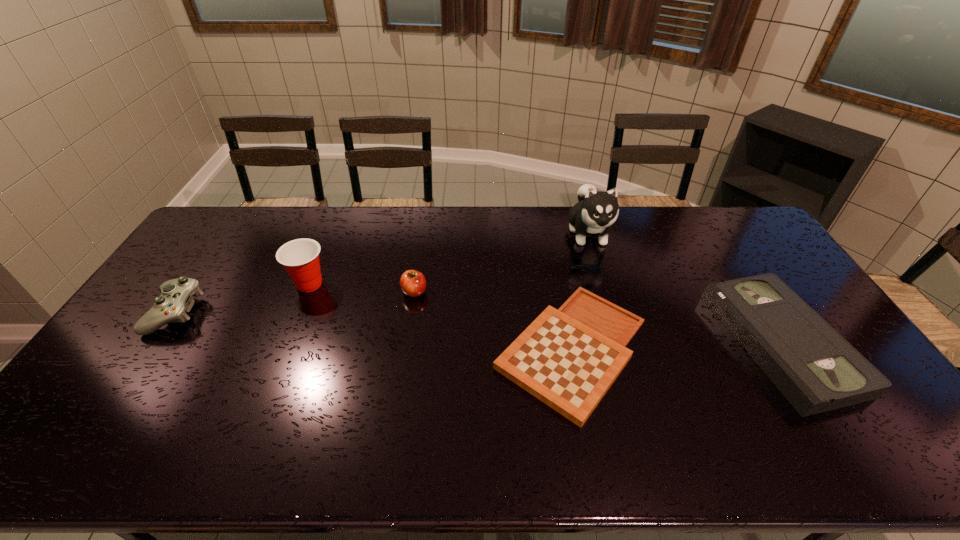
Identify the location of free region located 0.240m on the right of the cup. The height and width of the screenshot is (540, 960). (404, 284).

Identify the location of vacant space located on the back of the leftmost object. [x=228, y=235].

Identify the location of vacant space situated 0.100m on the back of the fourth object from right to left. [419, 263].

The height and width of the screenshot is (540, 960). In order to click on vacant position located on the back of the rightmost object in this screenshot , I will do `click(708, 227)`.

The height and width of the screenshot is (540, 960). Identify the location of vacant space located on the back of the gameboard. (556, 262).

Identify the location of object that is at the far edge. (596, 211).

You are a GUI agent. You are given a task and a screenshot of the screen. Output one action in this format:
    pyautogui.click(x=<x>, y=<y>)
    Task: Click on the object that is at the left edge
    The width and height of the screenshot is (960, 540).
    Given the screenshot: What is the action you would take?
    pyautogui.click(x=176, y=299)

Identify the location of object located at the right edge. The width and height of the screenshot is (960, 540). (812, 365).

In the image, there is a desktop. Identify the location of free space at the far edge. (521, 206).

Locate an element on the screen. The height and width of the screenshot is (540, 960). free space at the near edge of the desktop is located at coordinates (435, 465).